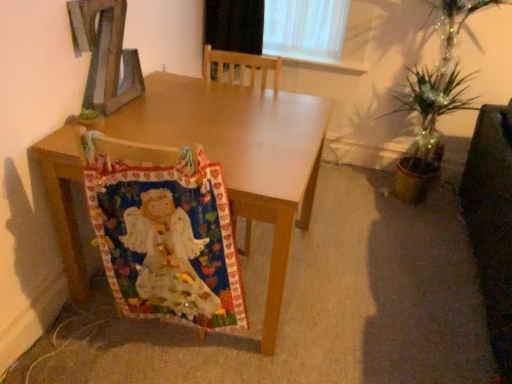
Question: Does wooden table at center have a greater width compared to multicolored fabric at lower left?

Choices:
 (A) no
 (B) yes

Answer: (B)

Question: Does wooden table at center have a lesser width compared to multicolored fabric at lower left?

Choices:
 (A) no
 (B) yes

Answer: (A)

Question: From a real-world perspective, is wooden table at center under multicolored fabric at lower left?

Choices:
 (A) yes
 (B) no

Answer: (A)

Question: Can multicolored fabric at lower left be found inside wooden table at center?

Choices:
 (A) yes
 (B) no

Answer: (A)

Question: Considering the relative sizes of wooden table at center and multicolored fabric at lower left in the image provided, is wooden table at center taller than multicolored fabric at lower left?

Choices:
 (A) no
 (B) yes

Answer: (A)

Question: From the image's perspective, would you say wooden table at center is positioned over multicolored fabric at lower left?

Choices:
 (A) yes
 (B) no

Answer: (A)

Question: Is multicolored fabric at lower left touching wooden letter z at upper left?

Choices:
 (A) yes
 (B) no

Answer: (B)

Question: Is multicolored fabric at lower left positioned in front of wooden letter z at upper left?

Choices:
 (A) yes
 (B) no

Answer: (A)

Question: Considering the relative sizes of multicolored fabric at lower left and wooden letter z at upper left in the image provided, is multicolored fabric at lower left wider than wooden letter z at upper left?

Choices:
 (A) no
 (B) yes

Answer: (B)

Question: Is multicolored fabric at lower left not close to wooden letter z at upper left?

Choices:
 (A) yes
 (B) no

Answer: (B)

Question: Is multicolored fabric at lower left at the right side of wooden letter z at upper left?

Choices:
 (A) yes
 (B) no

Answer: (A)

Question: From the image's perspective, would you say multicolored fabric at lower left is positioned over wooden letter z at upper left?

Choices:
 (A) yes
 (B) no

Answer: (B)

Question: Does wooden letter z at upper left have a smaller size compared to multicolored fabric at lower left?

Choices:
 (A) no
 (B) yes

Answer: (B)